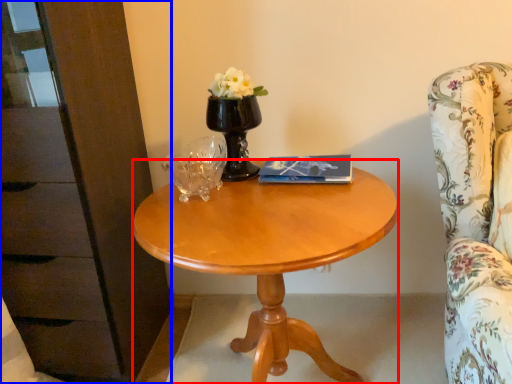
Question: Among these objects, which one is nearest to the camera, desk (highlighted by a red box) or dresser (highlighted by a blue box)?

Choices:
 (A) desk
 (B) dresser

Answer: (A)